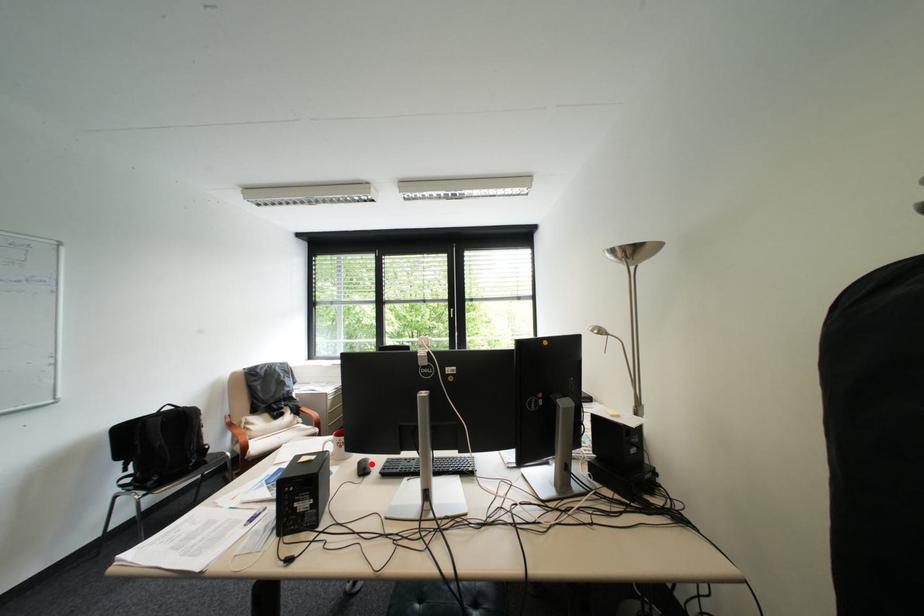
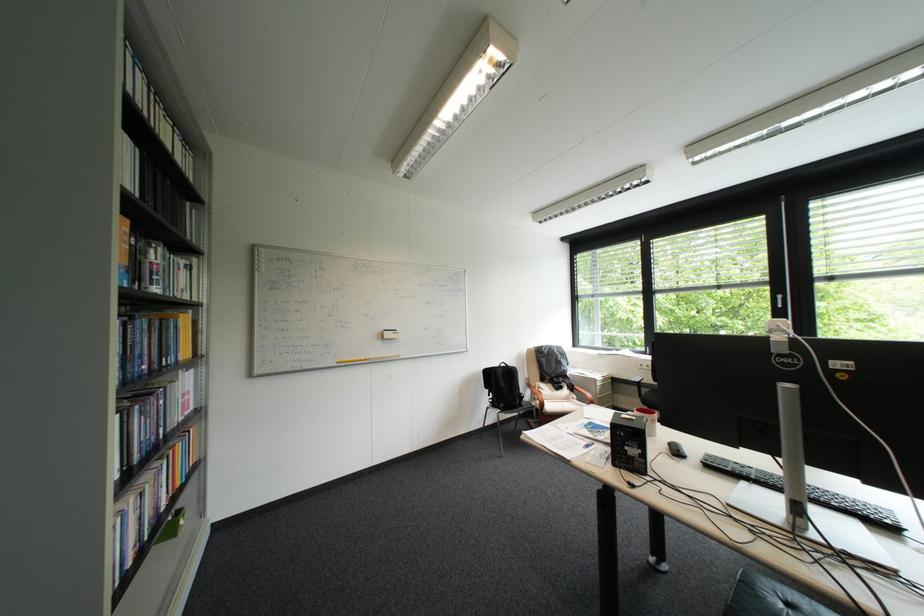
Find the pixel in the second image that matches the highlighted location in the first image.

(682, 445)